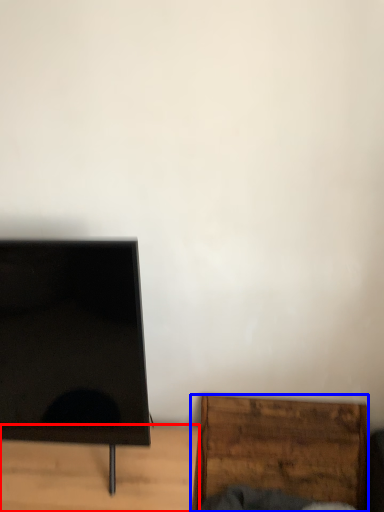
Question: Among these objects, which one is nearest to the camera, furniture (highlighted by a red box) or furniture (highlighted by a blue box)?

Choices:
 (A) furniture
 (B) furniture

Answer: (A)